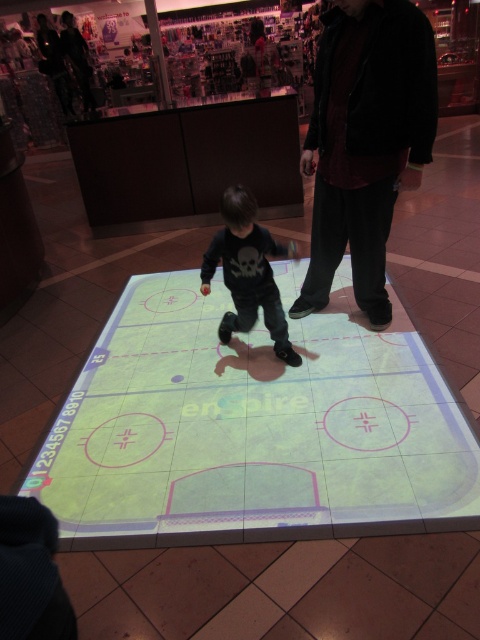
Which is above, green matte hockey rink at center or dark red fabric jacket at center?

dark red fabric jacket at center is higher up.

Does green matte hockey rink at center have a lesser width compared to dark red fabric jacket at center?

No, green matte hockey rink at center is not thinner than dark red fabric jacket at center.

Is point (431, 509) in front of point (312, 234)?

Yes, it is in front of point (312, 234).

I want to click on green matte hockey rink at center, so (252, 428).

Is dark red fabric jacket at center smaller than black matte shirt at center?

Actually, dark red fabric jacket at center might be larger than black matte shirt at center.

Does point (360, 67) come behind point (255, 288)?

No, (360, 67) is in front of (255, 288).

Find the location of a particular element. dark red fabric jacket at center is located at coordinates pyautogui.click(x=365, y=141).

At what (x,y) coordinates should I click in order to perform the action: click on dark red fabric jacket at center. Please return your answer as a coordinate pair (x, y). The width and height of the screenshot is (480, 640). Looking at the image, I should click on (365, 141).

Which of these two, green matte hockey rink at center or black matte shirt at center, stands taller?

With more height is green matte hockey rink at center.

Which is in front, point (265, 332) or point (214, 257)?

Positioned in front is point (214, 257).

Is point (384, 344) positioned before point (241, 276)?

No.

I want to click on green matte hockey rink at center, so click(252, 428).